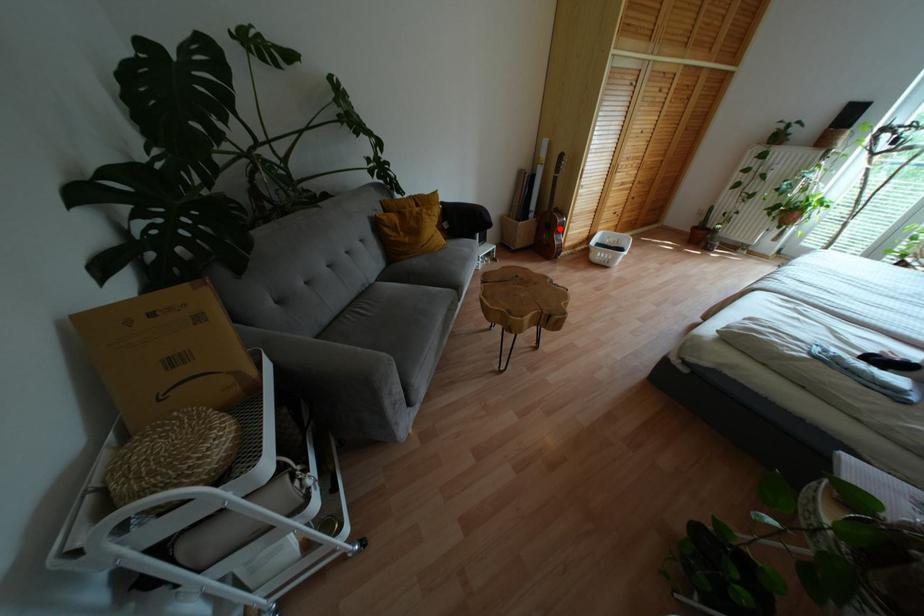
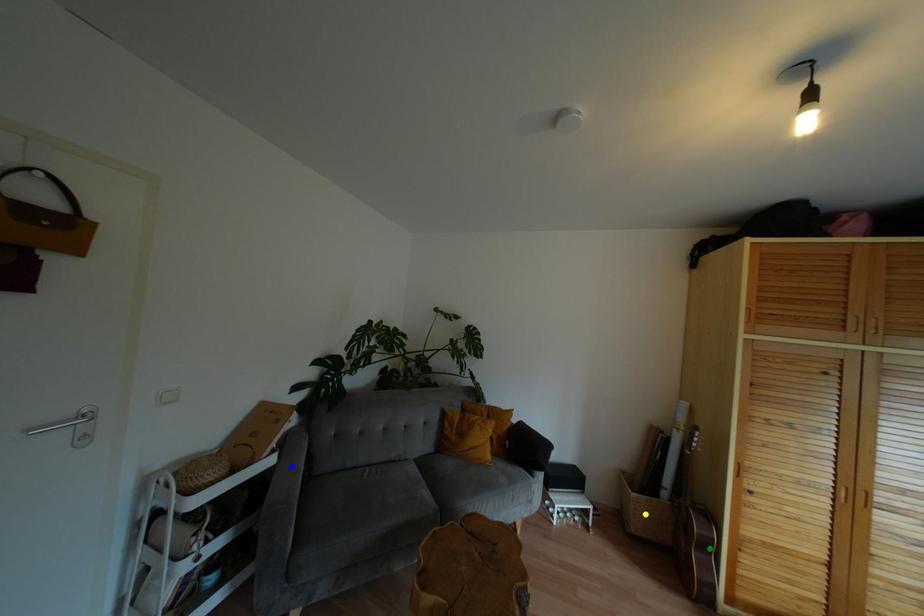
Question: I am providing you with two images of the same scene from different viewpoints. A red point is marked on the first image. You are given multiple points on the second image. Which mark in image 2 goes with the point in image 1?

Choices:
 (A) green point
 (B) blue point
 (C) yellow point

Answer: (A)